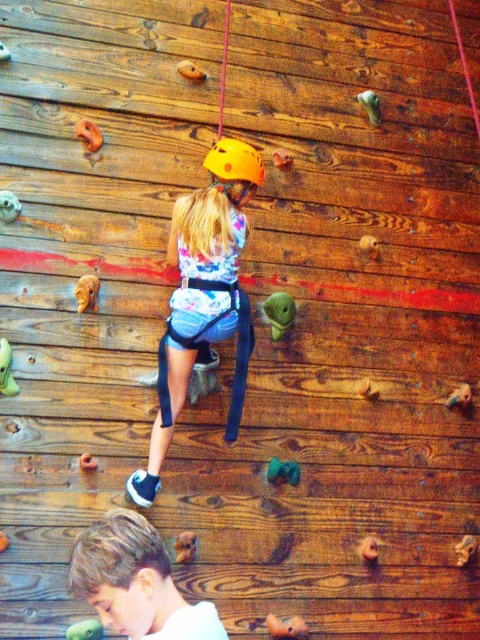
In the scene shown: You are trying to locate the matte yellow helmet at center in the image. According to the coordinates provided, where exactly is it positioned?

The matte yellow helmet at center is located at point coordinates of 0.464 on the x axis and 0.425 on the y axis.

You are a safety inspector checking the climbing wall. You notice a point at coordinates (x=204, y=296). What object is located at this point?

The point at coordinates (x=204, y=296) corresponds to the matte yellow helmet at center.